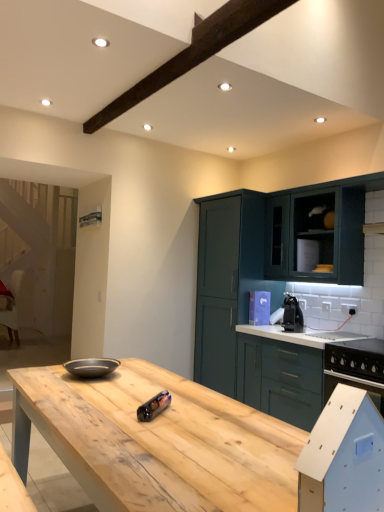
What are the coordinates of `vacant space to the right of metallic cylindrical can at center, placed as the 1th appliance when sorted from left to right` in the screenshot? It's located at (207, 414).